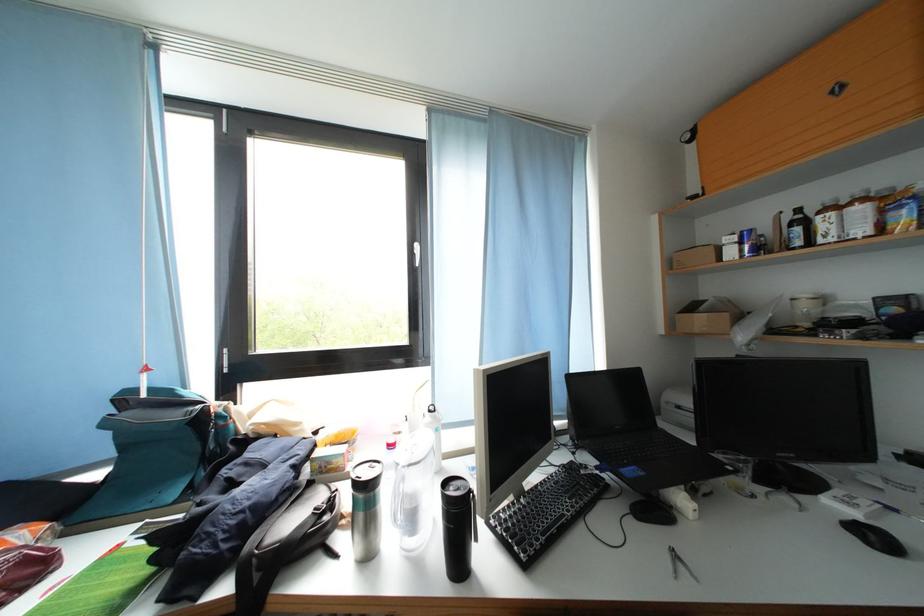
Where would you pull the cabinet door handle? Please return your answer as a coordinate pair (x, y).

(837, 89)